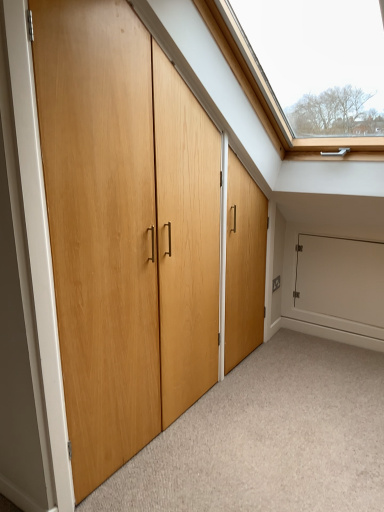
Question: Looking at their shapes, would you say light wood door at center is wider or thinner than natural wood door at center?

Choices:
 (A) wide
 (B) thin

Answer: (A)

Question: From a real-world perspective, relative to natural wood door at center, is light wood door at center vertically above or below?

Choices:
 (A) above
 (B) below

Answer: (B)

Question: Which object is the farthest from the light wood door at center?

Choices:
 (A) natural wood door at center
 (B) white matte cabinet at lower right

Answer: (B)

Question: Which of these objects is positioned closest to the light wood door at center?

Choices:
 (A) white matte cabinet at lower right
 (B) natural wood door at center

Answer: (B)